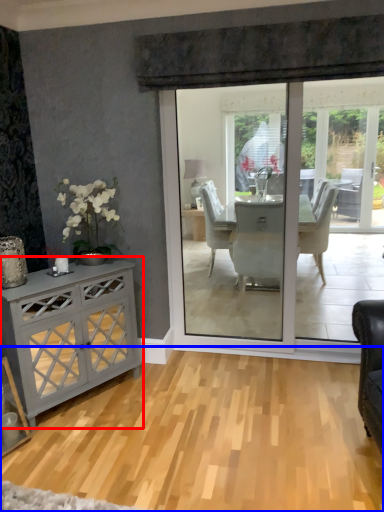
Question: Among these objects, which one is nearest to the camera, cabinetry (highlighted by a red box) or plain (highlighted by a blue box)?

Choices:
 (A) cabinetry
 (B) plain

Answer: (B)